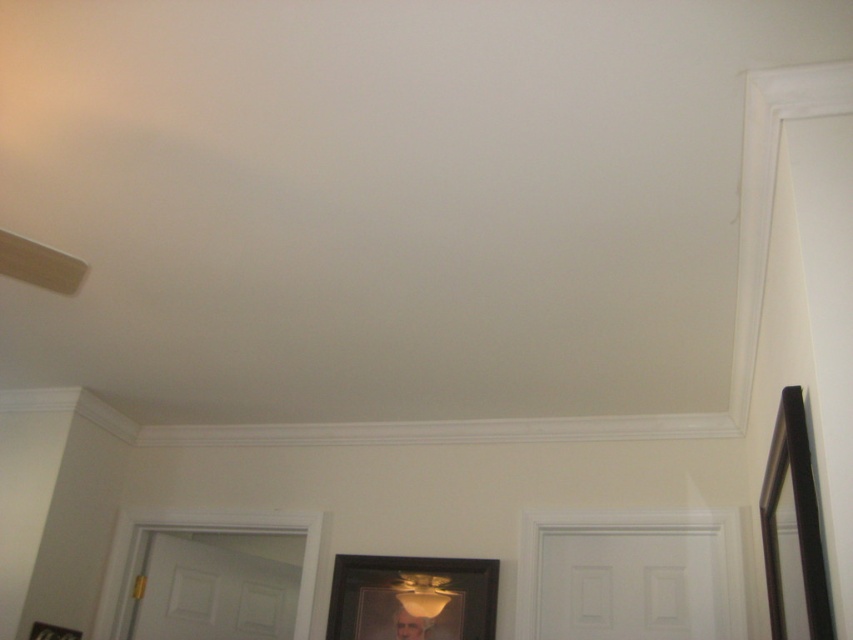
Question: Estimate the real-world distances between objects in this image. Which object is closer to the black matte picture frame at center?

Choices:
 (A) smooth gold portrait at center
 (B) matte yellow lampshade at center

Answer: (B)

Question: Which object appears closest to the camera in this image?

Choices:
 (A) smooth gold portrait at center
 (B) matte yellow lampshade at center

Answer: (A)

Question: Which of the following is the farthest from the observer?

Choices:
 (A) black matte picture frame at center
 (B) black matte picture frame at right
 (C) smooth gold portrait at center
 (D) matte yellow lampshade at center

Answer: (D)

Question: Considering the relative positions of black matte picture frame at center and matte yellow lampshade at center in the image provided, where is black matte picture frame at center located with respect to matte yellow lampshade at center?

Choices:
 (A) above
 (B) below

Answer: (A)

Question: From the image, what is the correct spatial relationship of black matte picture frame at center in relation to matte yellow lampshade at center?

Choices:
 (A) left
 (B) right

Answer: (A)

Question: Is the position of matte yellow lampshade at center less distant than that of smooth gold portrait at center?

Choices:
 (A) yes
 (B) no

Answer: (B)